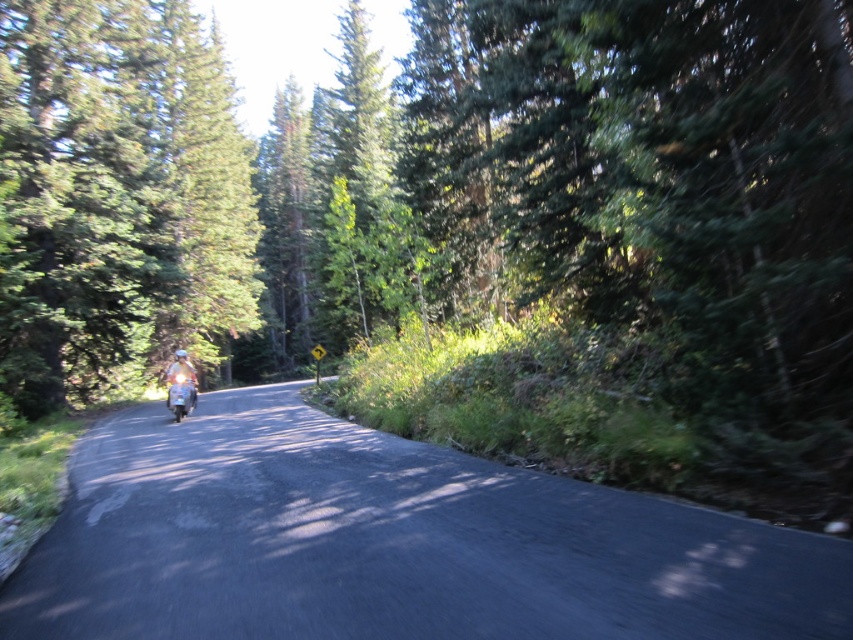
You are a hiker standing on the forest road and see the green textured tree at left and the metallic silver helmet at center. Which object is higher up in the image?

The green textured tree at left is located above the metallic silver helmet at center, so it is higher up in the image.

You are a photographer planning to capture the motorcycle rider and the tree in the scene. Given that the green textured tree at left and the metallic silver helmet at center are both in the frame, which object would appear larger in your photo?

The green textured tree at left would appear larger in the photo because it is bigger than the metallic silver helmet at center.

You are standing at the center of the forest road and want to take a photo of the green textured tree at left. Which direction should you point your camera to capture it?

The green textured tree at left is located at point (x=117, y=196), so you should point your camera to the left side of the road to capture it.